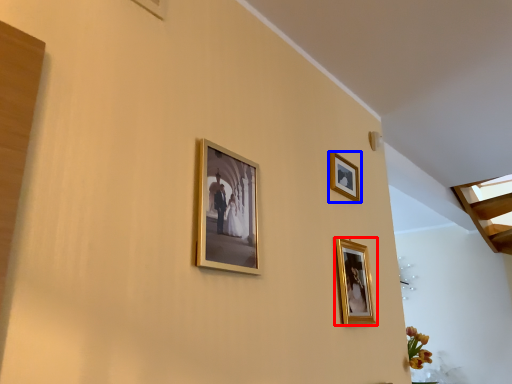
Question: Among these objects, which one is nearest to the camera, picture frame (highlighted by a red box) or picture frame (highlighted by a blue box)?

Choices:
 (A) picture frame
 (B) picture frame

Answer: (A)